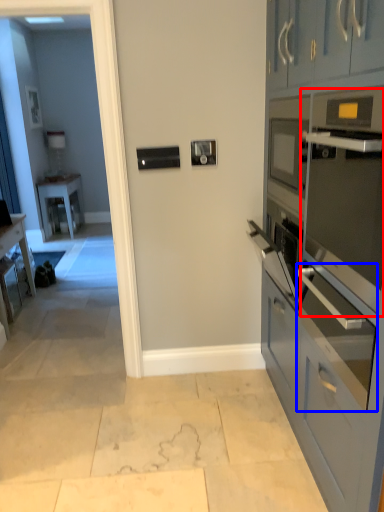
Question: Which of the following is the closest to the observer, oven (highlighted by a red box) or oven (highlighted by a blue box)?

Choices:
 (A) oven
 (B) oven

Answer: (A)